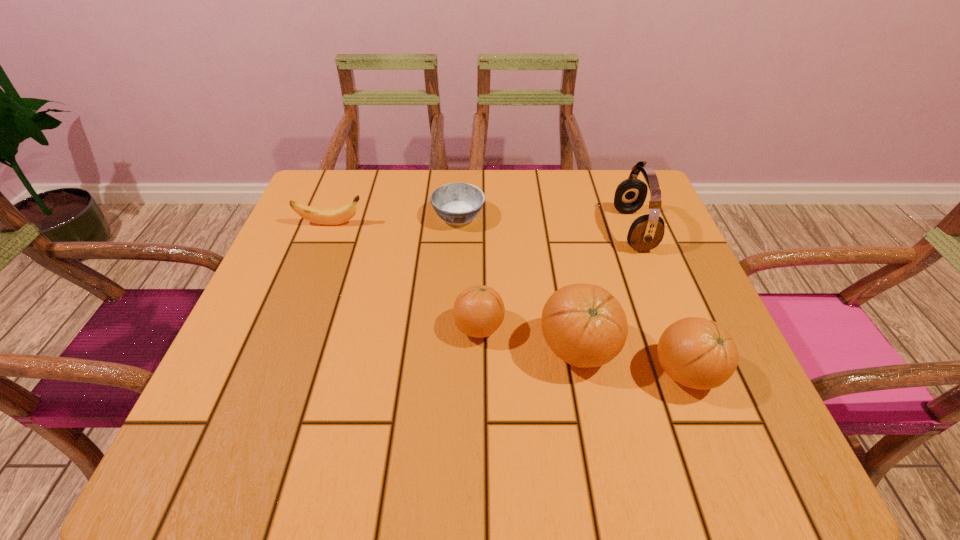
Locate an element on the screen. This screenshot has height=540, width=960. object that is at the left edge is located at coordinates (321, 216).

Identify the location of orange present at the right edge. (698, 353).

Identify the location of headset present at the right edge. The width and height of the screenshot is (960, 540). (646, 232).

Find the location of a particular element. Image resolution: width=960 pixels, height=540 pixels. object present at the far left corner is located at coordinates (321, 216).

The height and width of the screenshot is (540, 960). I want to click on object located in the far right corner section of the desktop, so click(x=646, y=232).

You are a GUI agent. You are given a task and a screenshot of the screen. Output one action in this format:
    pyautogui.click(x=<x>, y=<y>)
    Task: Click on the object that is at the near right corner
    Image resolution: width=960 pixels, height=540 pixels.
    Given the screenshot: What is the action you would take?
    pyautogui.click(x=698, y=353)

Find the location of `vacant region at the far edge of the desktop`. vacant region at the far edge of the desktop is located at coordinates (515, 219).

This screenshot has width=960, height=540. I want to click on free point at the left edge, so click(312, 322).

Locate an element on the screen. The image size is (960, 540). vacant space at the right edge is located at coordinates (626, 248).

Where is `free location at the near left corner of the desktop`? free location at the near left corner of the desktop is located at coordinates (253, 408).